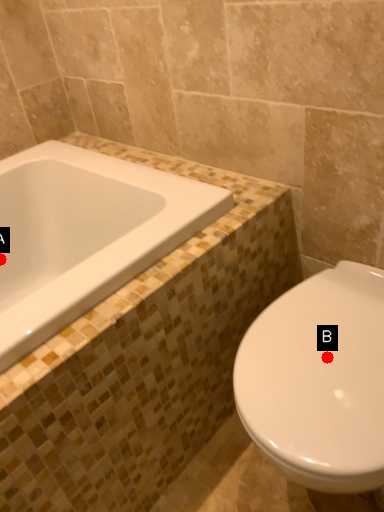
Question: Two points are circled on the image, labeled by A and B beside each circle. Among these points, which one is nearest to the camera?

Choices:
 (A) A is closer
 (B) B is closer

Answer: (B)